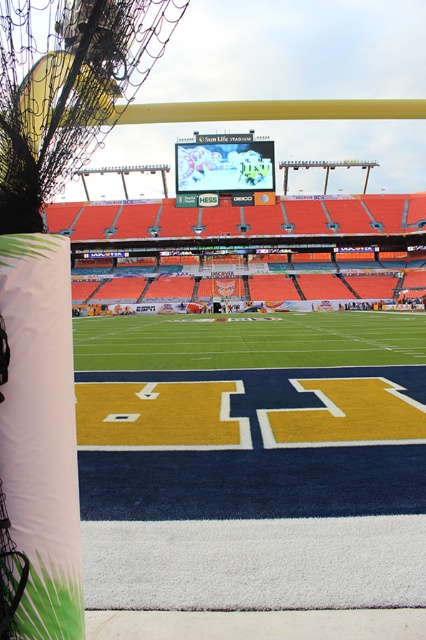
Question: Is yellow turf at center thinner than white fabric banner at left?

Choices:
 (A) no
 (B) yes

Answer: (A)

Question: Among these objects, which one is farthest from the camera?

Choices:
 (A) matte black scoreboard at center
 (B) white fabric banner at left
 (C) yellow turf at center
 (D) green turf football field at center

Answer: (A)

Question: Is the position of yellow turf at center less distant than that of green turf football field at center?

Choices:
 (A) yes
 (B) no

Answer: (A)

Question: Which object is positioned closest to the matte black scoreboard at center?

Choices:
 (A) yellow turf at center
 (B) green turf football field at center
 (C) white fabric banner at left

Answer: (B)

Question: Can you confirm if green turf football field at center is positioned to the left of matte black scoreboard at center?

Choices:
 (A) no
 (B) yes

Answer: (A)

Question: Among these objects, which one is nearest to the camera?

Choices:
 (A) matte black scoreboard at center
 (B) white fabric banner at left
 (C) yellow turf at center
 (D) green turf football field at center

Answer: (B)